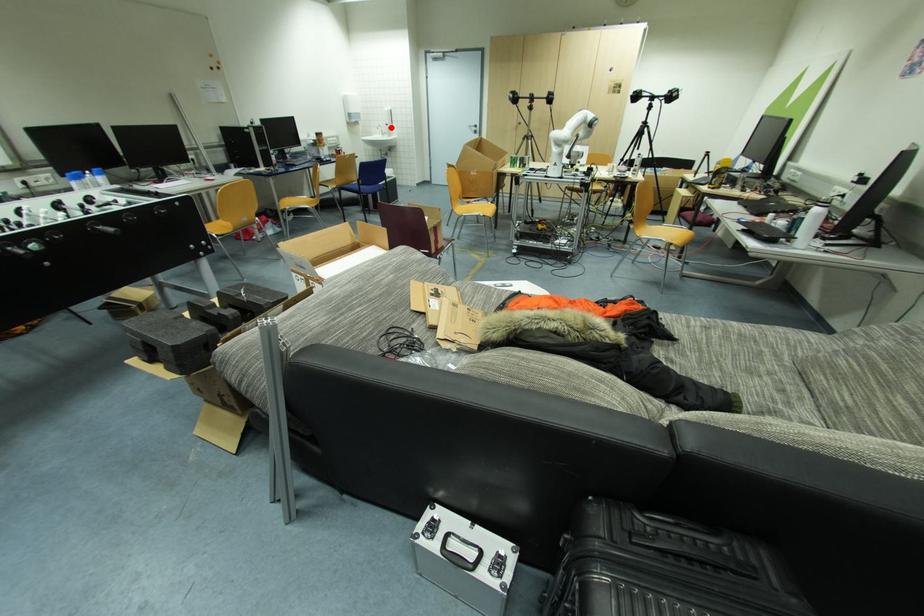
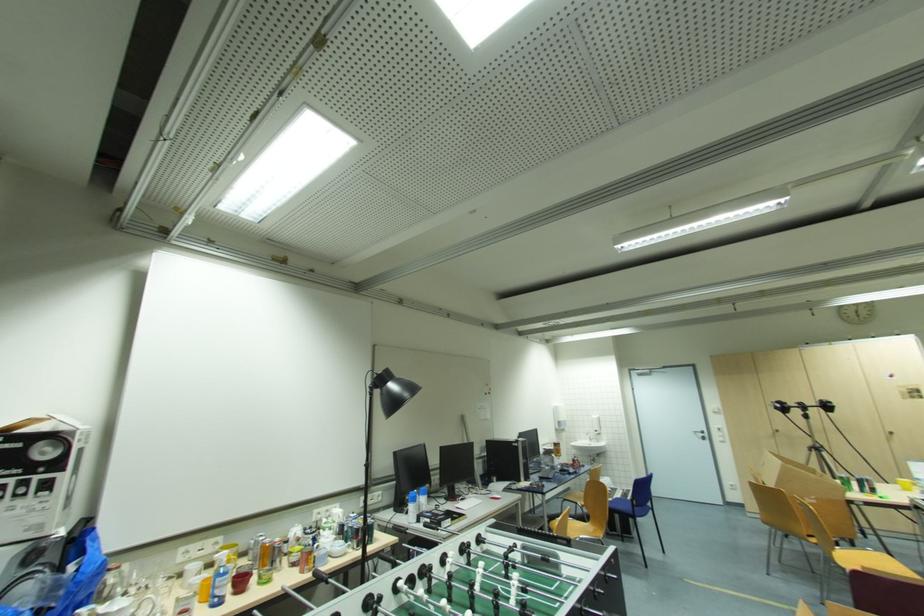
In the second image, find the point that corresponds to the highlighted location in the first image.

(601, 434)